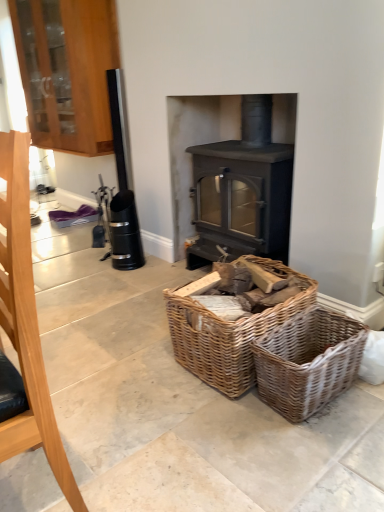
Where is `free space between brushed metal fireplace tool at left and woven wood basket at center`? free space between brushed metal fireplace tool at left and woven wood basket at center is located at coordinates (145, 424).